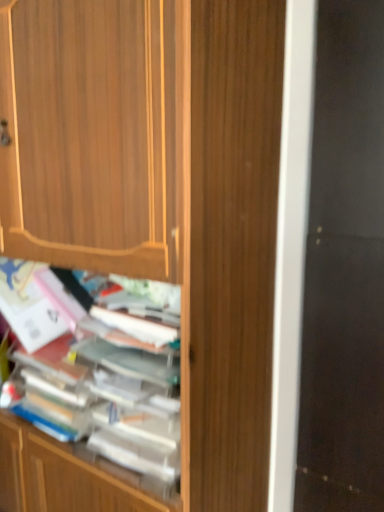
Question: Should I look upward or downward to see wooden books at center?

Choices:
 (A) up
 (B) down

Answer: (B)

Question: From a real-world perspective, is black glass screen door at right located beneath wooden books at center?

Choices:
 (A) no
 (B) yes

Answer: (A)

Question: From the image's perspective, does black glass screen door at right appear higher than wooden books at center?

Choices:
 (A) yes
 (B) no

Answer: (A)

Question: Are black glass screen door at right and wooden books at center located far from each other?

Choices:
 (A) yes
 (B) no

Answer: (B)

Question: From the image's perspective, is black glass screen door at right under wooden books at center?

Choices:
 (A) yes
 (B) no

Answer: (B)

Question: Is black glass screen door at right bigger than wooden books at center?

Choices:
 (A) no
 (B) yes

Answer: (B)

Question: Is black glass screen door at right further to camera compared to wooden books at center?

Choices:
 (A) no
 (B) yes

Answer: (B)

Question: Is the depth of black glass screen door at right less than that of wooden cabinet at center?

Choices:
 (A) no
 (B) yes

Answer: (A)

Question: Is black glass screen door at right thinner than wooden cabinet at center?

Choices:
 (A) yes
 (B) no

Answer: (B)

Question: Does black glass screen door at right have a greater width compared to wooden cabinet at center?

Choices:
 (A) no
 (B) yes

Answer: (B)

Question: From a real-world perspective, is black glass screen door at right beneath wooden cabinet at center?

Choices:
 (A) yes
 (B) no

Answer: (B)

Question: From the image's perspective, does black glass screen door at right appear higher than wooden cabinet at center?

Choices:
 (A) yes
 (B) no

Answer: (A)

Question: Is black glass screen door at right touching wooden cabinet at center?

Choices:
 (A) yes
 (B) no

Answer: (B)

Question: Is black glass screen door at right inside wooden books at center?

Choices:
 (A) yes
 (B) no

Answer: (B)